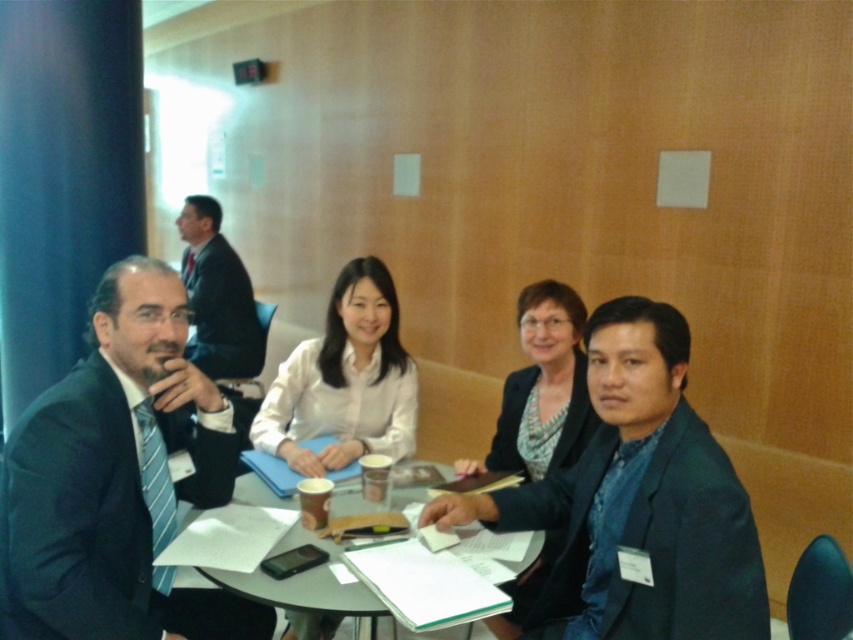
Question: Does matte plastic table at center appear over patterned fabric blazer at center?

Choices:
 (A) no
 (B) yes

Answer: (A)

Question: Is white matte shirt at center smaller than patterned fabric blazer at center?

Choices:
 (A) yes
 (B) no

Answer: (B)

Question: Which is nearer to the dark blue textured blazer at lower right?

Choices:
 (A) patterned fabric blazer at center
 (B) matte plastic table at center

Answer: (A)

Question: Which point appears farthest from the camera in this image?

Choices:
 (A) (73, 435)
 (B) (271, 497)

Answer: (B)

Question: Which point is farther to the camera?

Choices:
 (A) (138, 630)
 (B) (289, 600)
 (C) (651, 611)
 (D) (281, 413)

Answer: (D)

Question: Can you confirm if dark blue textured blazer at lower right is thinner than white matte shirt at center?

Choices:
 (A) no
 (B) yes

Answer: (B)